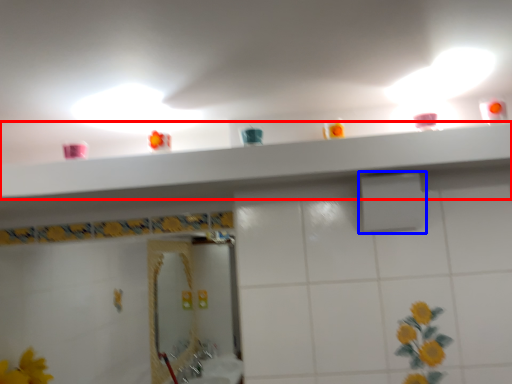
Question: Among these objects, which one is farthest to the camera, shelve (highlighted by a red box) or shower (highlighted by a blue box)?

Choices:
 (A) shelve
 (B) shower

Answer: (B)